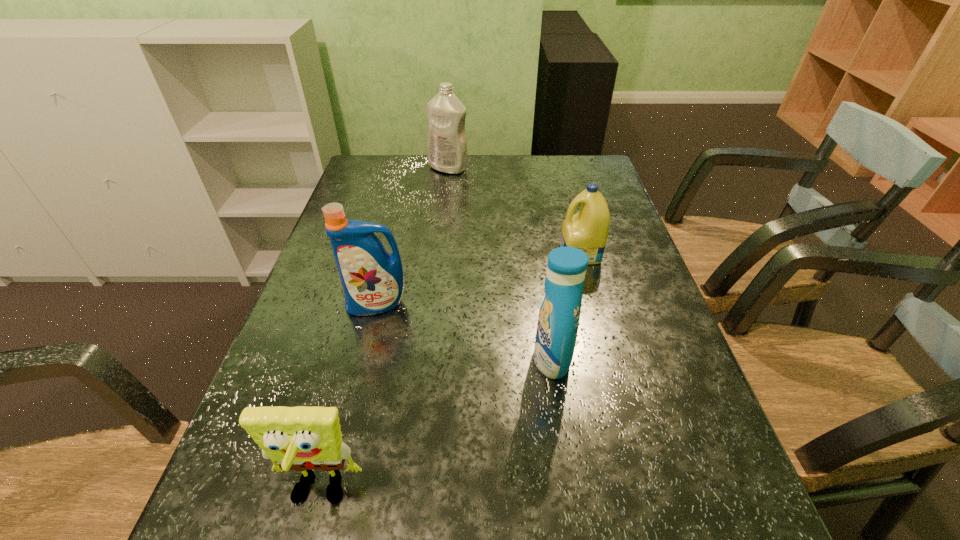
Locate an element on the screen. The height and width of the screenshot is (540, 960). the farthest object is located at coordinates (446, 142).

Locate an element on the screen. the third farthest detergent is located at coordinates (372, 279).

Locate an element on the screen. The height and width of the screenshot is (540, 960). the third detergent from left to right is located at coordinates (559, 314).

Where is `the fourth object from left to right`? the fourth object from left to right is located at coordinates (559, 314).

At what (x,y) coordinates should I click in order to perform the action: click on the third nearest detergent. Please return your answer as a coordinate pair (x, y). This screenshot has height=540, width=960. Looking at the image, I should click on (587, 230).

Locate an element on the screen. The height and width of the screenshot is (540, 960). the rightmost detergent is located at coordinates (587, 230).

This screenshot has height=540, width=960. Identify the location of the nearest object. (301, 438).

Locate an element on the screen. vacant area situated on the right of the farthest detergent is located at coordinates click(x=517, y=168).

Where is `blank area located on the label of the second nearest detergent`? The image size is (960, 540). blank area located on the label of the second nearest detergent is located at coordinates (359, 380).

The height and width of the screenshot is (540, 960). Identify the location of free spot located 0.110m on the front-facing side of the second nearest object. (480, 359).